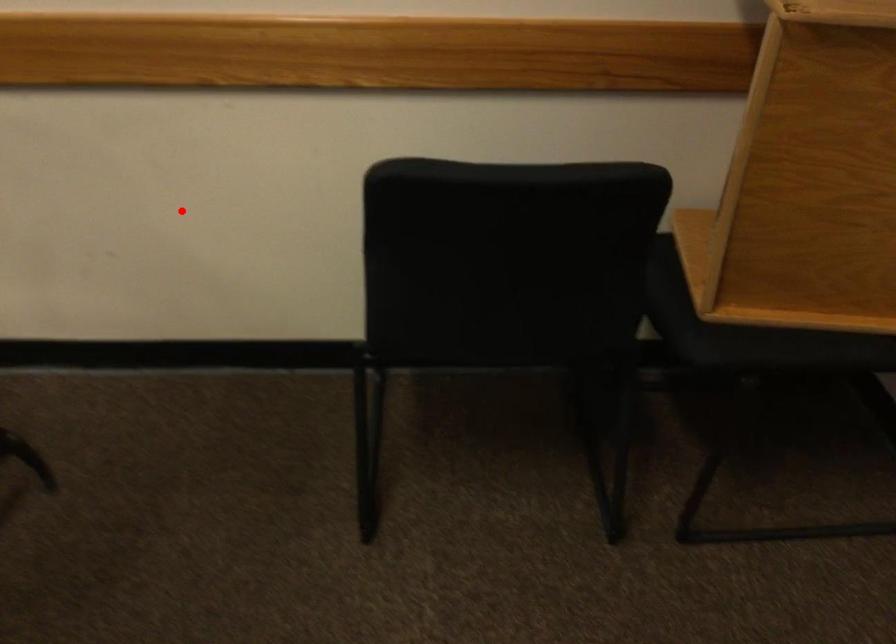
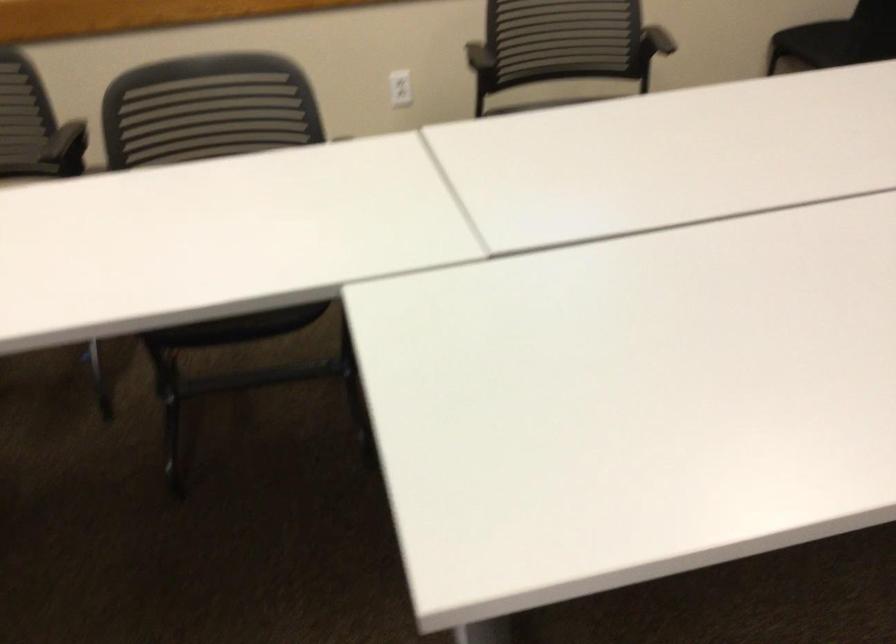
Where in the second image is the point corresponding to the highlighted location from the first image?

(676, 43)